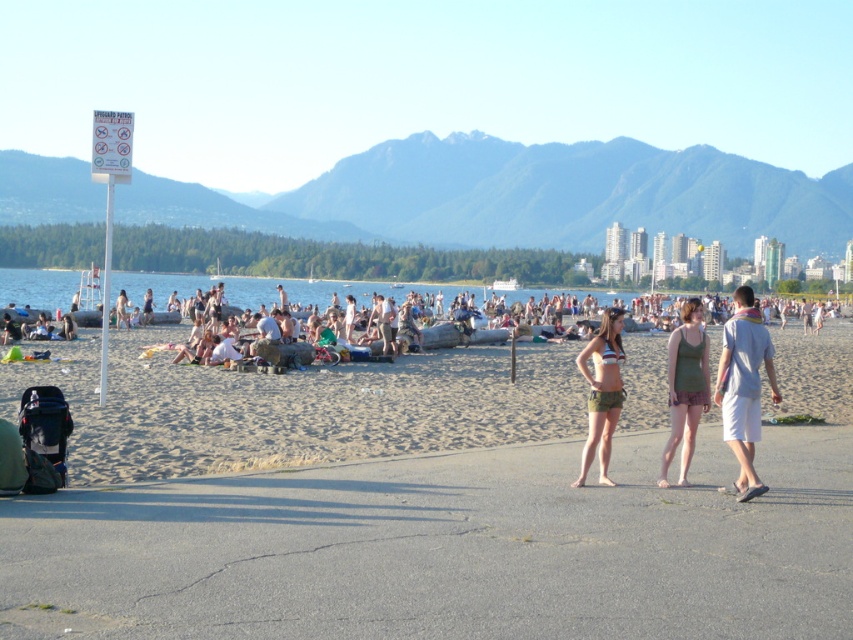
Which is below, sandy beach at center or green fabric bikini bottom at center?

sandy beach at center is lower down.

Does point (161, 365) come closer to viewer compared to point (708, 374)?

No, it is not.

Between point (440, 413) and point (701, 372), which one is positioned in front?

Point (701, 372) is more forward.

Locate an element on the screen. The width and height of the screenshot is (853, 640). sandy beach at center is located at coordinates (296, 406).

Measure the distance between sandy beach at center and black fabric baby carriage at lower left.

They are 14.38 meters apart.

Which is more to the left, sandy beach at center or black fabric baby carriage at lower left?

black fabric baby carriage at lower left is more to the left.

Is point (804, 336) farther from viewer compared to point (39, 410)?

Yes, it is behind point (39, 410).

The height and width of the screenshot is (640, 853). In order to click on sandy beach at center in this screenshot , I will do `click(296, 406)`.

Can you confirm if sandy beach at center is positioned above striped bikini top at center?

Actually, sandy beach at center is below striped bikini top at center.

Between point (184, 392) and point (606, 330), which one is positioned behind?

The point (184, 392) is more distant.

Is point (519, 390) closer to viewer compared to point (601, 356)?

No, (519, 390) is further to viewer.

Where is `sandy beach at center`? This screenshot has width=853, height=640. sandy beach at center is located at coordinates (296, 406).